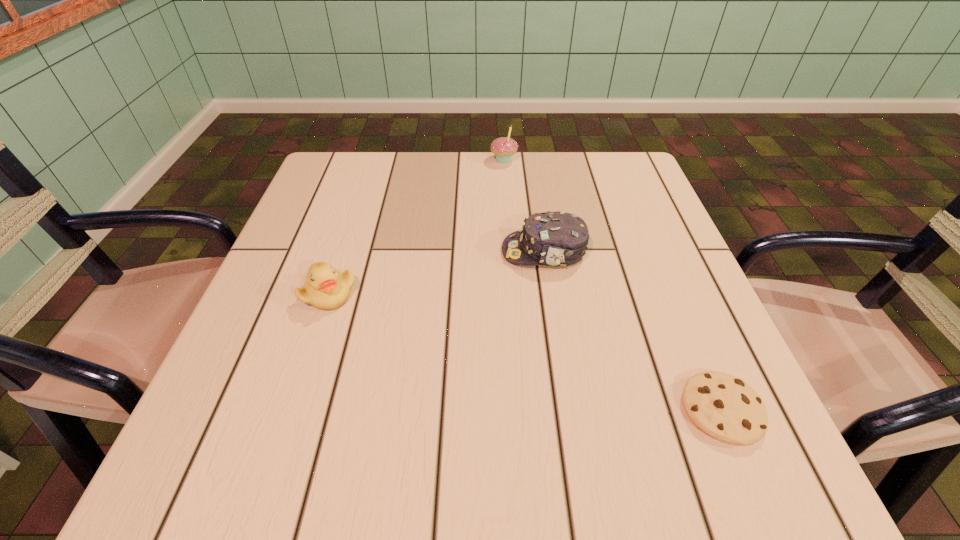
The image size is (960, 540). In order to click on free space that satisfies the following two spatial constraints: 1. on the beak of the second nearest object; 2. on the left side of the shortest object in this screenshot , I will do `click(290, 410)`.

Identify the location of free spot that satisfies the following two spatial constraints: 1. on the front-facing side of the headwear; 2. on the left side of the nearest object. (569, 410).

Identify the location of free location that satisfies the following two spatial constraints: 1. on the beak of the shortest object; 2. on the left side of the second nearest object. (290, 410).

You are a GUI agent. You are given a task and a screenshot of the screen. Output one action in this format:
    pyautogui.click(x=<x>, y=<y>)
    Task: Click on the vacant space that satisfies the following two spatial constraints: 1. on the beak of the duckling; 2. on the right side of the nearest object
    The image size is (960, 540).
    Given the screenshot: What is the action you would take?
    pyautogui.click(x=290, y=410)